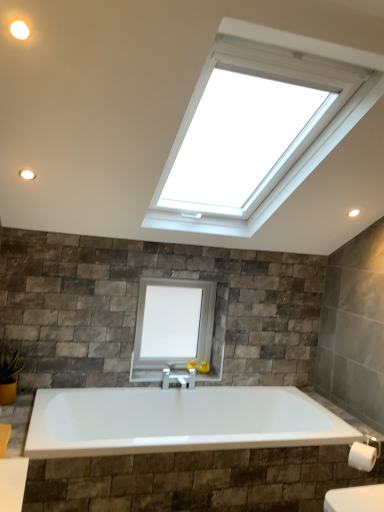
What are the coordinates of `white matte window at center` in the screenshot? It's located at (172, 326).

Measure the distance between point (16, 26) and camera.

The depth of point (16, 26) is 4.43 feet.

What is the approximate width of green glossy plant at lower left?

6.16 inches.

What is the approximate width of white matte toilet paper at lower right?

The width of white matte toilet paper at lower right is 4.11 inches.

Find the location of `white matte window at center`. white matte window at center is located at coordinates (172, 326).

Who is smaller, white matte window at center or white matte light fixture at upper left?

white matte light fixture at upper left.

Does point (211, 300) come in front of point (14, 27)?

No.

Does white matte window at center have a lesser width compared to white matte light fixture at upper left?

No, white matte window at center is not thinner than white matte light fixture at upper left.

Does white matte light fixture at upper left lie behind green glossy plant at lower left?

No, it is not.

Considering the positions of points (12, 31) and (8, 366), is point (12, 31) farther from camera compared to point (8, 366)?

No, (12, 31) is in front of (8, 366).

Is white matte light fixture at upper left touching green glossy plant at lower left?

white matte light fixture at upper left and green glossy plant at lower left are not in contact.

In terms of size, does white matte light fixture at upper left appear bigger or smaller than green glossy plant at lower left?

white matte light fixture at upper left is smaller than green glossy plant at lower left.

Which object is positioned more to the right, matte white light fixture at upper left or green glossy plant at lower left?

From the viewer's perspective, matte white light fixture at upper left appears more on the right side.

From the picture: Does matte white light fixture at upper left come behind green glossy plant at lower left?

No, it is not.

Is matte white light fixture at upper left positioned far away from green glossy plant at lower left?

Yes.

Is matte white light fixture at upper left shorter than green glossy plant at lower left?

Yes, matte white light fixture at upper left is shorter than green glossy plant at lower left.

Which of these two, white matte light fixture at upper left or white matte toilet paper at lower right, is wider?

white matte toilet paper at lower right is wider.

Is point (14, 31) farther from camera compared to point (361, 455)?

No, (14, 31) is in front of (361, 455).

Is white matte light fixture at upper left located outside white matte toilet paper at lower right?

Yes.

Which is behind, white matte light fixture at upper left or white matte toilet paper at lower right?

white matte toilet paper at lower right is behind.

Which is more to the right, white matte window at center or matte white light fixture at upper left?

white matte window at center is more to the right.

How different are the orientations of white matte window at center and matte white light fixture at upper left in degrees?

The angular difference between white matte window at center and matte white light fixture at upper left is 0.829 degrees.

Is white matte window at center positioned before matte white light fixture at upper left?

No, the depth of white matte window at center is greater than that of matte white light fixture at upper left.

Does white matte window at center have a lesser height compared to matte white light fixture at upper left?

No, white matte window at center is not shorter than matte white light fixture at upper left.

Which of these two, matte white light fixture at upper left or white matte toilet paper at lower right, is smaller?

matte white light fixture at upper left.

Where is `toilet paper behind the matte white light fixture at upper left`? toilet paper behind the matte white light fixture at upper left is located at coordinates (362, 456).

Is matte white light fixture at upper left to the left of white matte toilet paper at lower right from the viewer's perspective?

Indeed, matte white light fixture at upper left is positioned on the left side of white matte toilet paper at lower right.

Between matte white light fixture at upper left and white matte toilet paper at lower right, which one has larger width?

white matte toilet paper at lower right is wider.

Is matte white light fixture at upper left closer to camera compared to white matte window at center?

Yes, matte white light fixture at upper left is closer to the camera.

How far apart are matte white light fixture at upper left and white matte window at center?

matte white light fixture at upper left and white matte window at center are 5.09 feet apart from each other.

Is matte white light fixture at upper left completely or partially outside of white matte window at center?

Yes, matte white light fixture at upper left is outside of white matte window at center.

Between matte white light fixture at upper left and white matte window at center, which one appears on the right side from the viewer's perspective?

From the viewer's perspective, white matte window at center appears more on the right side.

Locate an element on the screen. lighting above the white matte window at center (from a real-world perspective) is located at coordinates (19, 30).

Identify the location of lighting lying above the green glossy plant at lower left (from the image's perspective). (19, 30).

Looking at the image, which one is located further to green glossy plant at lower left, white matte toilet paper at lower right or white matte window at center?

Among the two, white matte toilet paper at lower right is located further to green glossy plant at lower left.

Based on their spatial positions, is white matte light fixture at upper left or green glossy plant at lower left closer to white matte window at center?

green glossy plant at lower left.

Based on the photo, considering their positions, is white matte window at center positioned closer to white matte light fixture at upper left than matte white light fixture at upper left?

Among the two, matte white light fixture at upper left is located nearer to white matte light fixture at upper left.

Based on their spatial positions, is green glossy plant at lower left or matte white light fixture at upper left further from white matte toilet paper at lower right?

matte white light fixture at upper left is positioned further to the anchor white matte toilet paper at lower right.

Based on their spatial positions, is white matte light fixture at upper left or matte white light fixture at upper left closer to white matte window at center?

matte white light fixture at upper left.

Looking at the image, which one is located closer to white matte toilet paper at lower right, matte white light fixture at upper left or white matte window at center?

Among the two, white matte window at center is located nearer to white matte toilet paper at lower right.

Based on their spatial positions, is matte white light fixture at upper left or white matte toilet paper at lower right closer to white matte window at center?

Among the two, white matte toilet paper at lower right is located nearer to white matte window at center.

Looking at the image, which one is located further to white matte window at center, matte white light fixture at upper left or white matte light fixture at upper left?

Among the two, white matte light fixture at upper left is located further to white matte window at center.

At what (x,y) coordinates should I click in order to perform the action: click on window located between green glossy plant at lower left and white matte toilet paper at lower right in the left-right direction. Please return your answer as a coordinate pair (x, y). This screenshot has height=512, width=384. Looking at the image, I should click on (172, 326).

Where is `window between white matte light fixture at upper left and white matte toilet paper at lower right from top to bottom`? The height and width of the screenshot is (512, 384). window between white matte light fixture at upper left and white matte toilet paper at lower right from top to bottom is located at coordinates (172, 326).

Find the location of a particular element. Image resolution: width=384 pixels, height=512 pixels. light fixture between green glossy plant at lower left and white matte toilet paper at lower right in the horizontal direction is located at coordinates (27, 174).

Identify the location of light fixture between white matte light fixture at upper left and white matte toilet paper at lower right vertically. (27, 174).